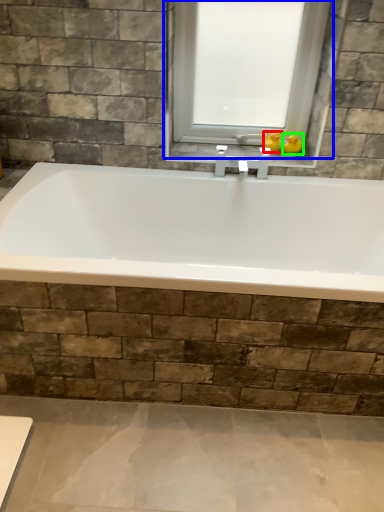
Question: Estimate the real-world distances between objects in this image. Which object is farther from duck (highlighted by a red box), window (highlighted by a blue box) or duck (highlighted by a green box)?

Choices:
 (A) window
 (B) duck

Answer: (A)